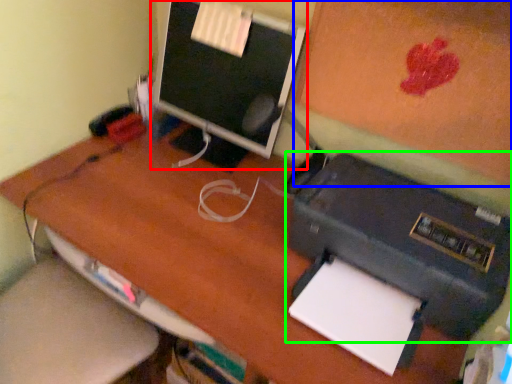
Question: Based on their relative distances, which object is nearer to computer monitor (highlighted by a red box)? Choose from bulletin board (highlighted by a blue box) and printer (highlighted by a green box).

Choices:
 (A) bulletin board
 (B) printer

Answer: (A)